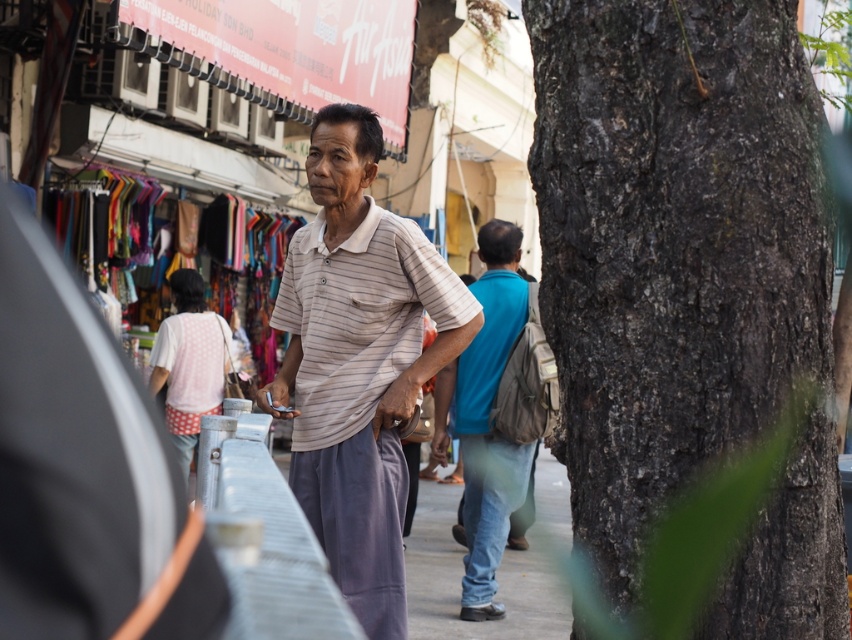
Which is more to the left, dark brown bark at right or striped cotton shirt at center?

From the viewer's perspective, striped cotton shirt at center appears more on the left side.

The width and height of the screenshot is (852, 640). What do you see at coordinates (672, 243) in the screenshot?
I see `dark brown bark at right` at bounding box center [672, 243].

Locate an element on the screen. The image size is (852, 640). dark brown bark at right is located at coordinates (672, 243).

Does dark brown bark at right appear on the left side of gray concrete pavement at center?

Indeed, dark brown bark at right is positioned on the left side of gray concrete pavement at center.

Is point (793, 456) less distant than point (430, 637)?

Yes, it is in front of point (430, 637).

Image resolution: width=852 pixels, height=640 pixels. In order to click on dark brown bark at right in this screenshot , I will do `click(672, 243)`.

Who is more forward, (597, 74) or (519, 284)?

Point (597, 74) is more forward.

Who is positioned more to the right, dark brown bark at right or blue denim jeans at center?

dark brown bark at right is more to the right.

Is point (648, 100) closer to camera compared to point (488, 477)?

That is True.

The height and width of the screenshot is (640, 852). I want to click on dark brown bark at right, so click(x=672, y=243).